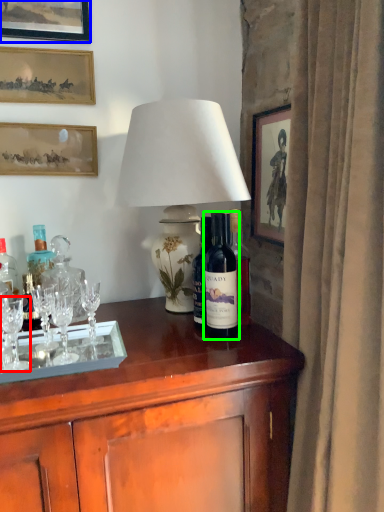
Question: Estimate the real-world distances between objects in this image. Which object is farther from wine glass (highlighted by a red box), picture frame (highlighted by a blue box) or bottle (highlighted by a green box)?

Choices:
 (A) picture frame
 (B) bottle

Answer: (A)